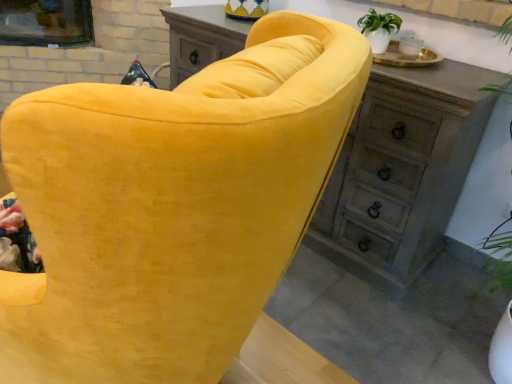
What is the approximate width of velvet yellow sofa at center?

velvet yellow sofa at center is 3.40 feet in width.

What are the coordinates of `wooden chest of drawers at upper center` in the screenshot? It's located at (402, 171).

Identify the location of wooden dresser at center. The width and height of the screenshot is (512, 384). (402, 171).

Considering the relative sizes of wooden dresser at center and wooden chest of drawers at upper center in the image provided, is wooden dresser at center thinner than wooden chest of drawers at upper center?

In fact, wooden dresser at center might be wider than wooden chest of drawers at upper center.

From the image's perspective, is wooden dresser at center above wooden chest of drawers at upper center?

No, from the image's perspective, wooden dresser at center is not above wooden chest of drawers at upper center.

Does wooden dresser at center have a greater height compared to wooden chest of drawers at upper center?

Correct, wooden dresser at center is much taller as wooden chest of drawers at upper center.

Who is bigger, wooden dresser at center or wooden chest of drawers at upper center?

Bigger between the two is wooden chest of drawers at upper center.

Between velvet yellow sofa at center and wooden dresser at center, which one is positioned in front?

Positioned in front is velvet yellow sofa at center.

From the image's perspective, which one is positioned higher, velvet yellow sofa at center or wooden dresser at center?

wooden dresser at center, from the image's perspective.

From a real-world perspective, which is physically below, velvet yellow sofa at center or wooden dresser at center?

In real-world perspective, velvet yellow sofa at center is lower.

Is velvet yellow sofa at center smaller than wooden dresser at center?

Actually, velvet yellow sofa at center might be larger than wooden dresser at center.

Would you say wooden chest of drawers at upper center is inside or outside velvet yellow sofa at center?

wooden chest of drawers at upper center lies outside velvet yellow sofa at center.

Is wooden chest of drawers at upper center not close to velvet yellow sofa at center?

No, wooden chest of drawers at upper center is not far from velvet yellow sofa at center.

Is the position of wooden chest of drawers at upper center more distant than that of velvet yellow sofa at center?

Yes.

Identify the location of the chest of drawers located behind the velvet yellow sofa at center. The width and height of the screenshot is (512, 384). (402, 171).

Would you say wooden dresser at center is a long distance from velvet yellow sofa at center?

wooden dresser at center is near velvet yellow sofa at center, not far away.

Between wooden dresser at center and velvet yellow sofa at center, which one is positioned behind?

wooden dresser at center is behind.

Between point (390, 216) and point (251, 92), which one is positioned behind?

The point (390, 216) is farther.

From a real-world perspective, is wooden dresser at center located higher than velvet yellow sofa at center?

Yes, from a real-world perspective, wooden dresser at center is on top of velvet yellow sofa at center.

Would you say velvet yellow sofa at center is a long distance from wooden chest of drawers at upper center?

No, velvet yellow sofa at center is not far away from wooden chest of drawers at upper center.

Considering the points (242, 93) and (343, 201), which point is in front, point (242, 93) or point (343, 201)?

Positioned in front is point (242, 93).

From a real-world perspective, is velvet yellow sofa at center positioned above or below wooden chest of drawers at upper center?

From a real-world perspective, velvet yellow sofa at center is physically above wooden chest of drawers at upper center.

Which object is further away from the camera, velvet yellow sofa at center or wooden chest of drawers at upper center?

wooden chest of drawers at upper center is more distant.

Image resolution: width=512 pixels, height=384 pixels. There is a wooden chest of drawers at upper center. What are the coordinates of `dresser above it (from a real-world perspective)` in the screenshot? It's located at (402, 171).

In the scene shown: Can you confirm if wooden chest of drawers at upper center is wider than wooden dresser at center?

In fact, wooden chest of drawers at upper center might be narrower than wooden dresser at center.

Is wooden chest of drawers at upper center smaller than wooden dresser at center?

No.

In the scene shown: Which object is positioned more to the right, wooden chest of drawers at upper center or wooden dresser at center?

From the viewer's perspective, wooden dresser at center appears more on the right side.

This screenshot has height=384, width=512. Identify the location of the chest of drawers behind the wooden dresser at center. (402, 171).

I want to click on dresser that is above the velvet yellow sofa at center (from the image's perspective), so click(x=402, y=171).

Estimate the real-world distances between objects in this image. Which object is closer to wooden dresser at center, velvet yellow sofa at center or wooden chest of drawers at upper center?

Based on the image, wooden chest of drawers at upper center appears to be nearer to wooden dresser at center.

Based on their spatial positions, is wooden dresser at center or wooden chest of drawers at upper center closer to velvet yellow sofa at center?

The object closer to velvet yellow sofa at center is wooden dresser at center.

Considering their positions, is wooden chest of drawers at upper center positioned closer to wooden dresser at center than velvet yellow sofa at center?

wooden chest of drawers at upper center is closer to wooden dresser at center.

Based on their spatial positions, is wooden chest of drawers at upper center or wooden dresser at center further from velvet yellow sofa at center?

Among the two, wooden chest of drawers at upper center is located further to velvet yellow sofa at center.

Looking at the image, which one is located closer to wooden chest of drawers at upper center, wooden dresser at center or velvet yellow sofa at center?

The object closer to wooden chest of drawers at upper center is wooden dresser at center.

From the image, which object appears to be farther from wooden chest of drawers at upper center, velvet yellow sofa at center or wooden dresser at center?

velvet yellow sofa at center.

Locate an element on the screen. chest of drawers between velvet yellow sofa at center and wooden dresser at center from left to right is located at coordinates (402, 171).